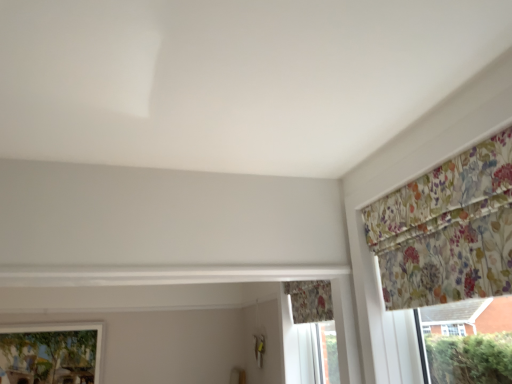
Question: Which is correct: matte glass window at lower left is inside floral fabric curtain at upper right, which ranks as the 2th curtain in back-to-front order, or outside of it?

Choices:
 (A) outside
 (B) inside

Answer: (A)

Question: From the image's perspective, is matte glass window at lower left positioned above or below floral fabric curtain at upper right, the first curtain positioned from the right?

Choices:
 (A) below
 (B) above

Answer: (A)

Question: Based on their relative distances, which object is farther from the floral fabric curtain at upper right, acting as the 2th curtain starting from the left?

Choices:
 (A) matte glass window at lower left
 (B) floral fabric curtain at lower center, which ranks as the 1th curtain in back-to-front order

Answer: (A)

Question: Considering the real-world distances, which object is closest to the floral fabric curtain at lower center, which ranks as the 1th curtain in back-to-front order?

Choices:
 (A) matte glass window at lower left
 (B) floral fabric curtain at upper right, positioned as the 1th curtain in top-to-bottom order

Answer: (B)